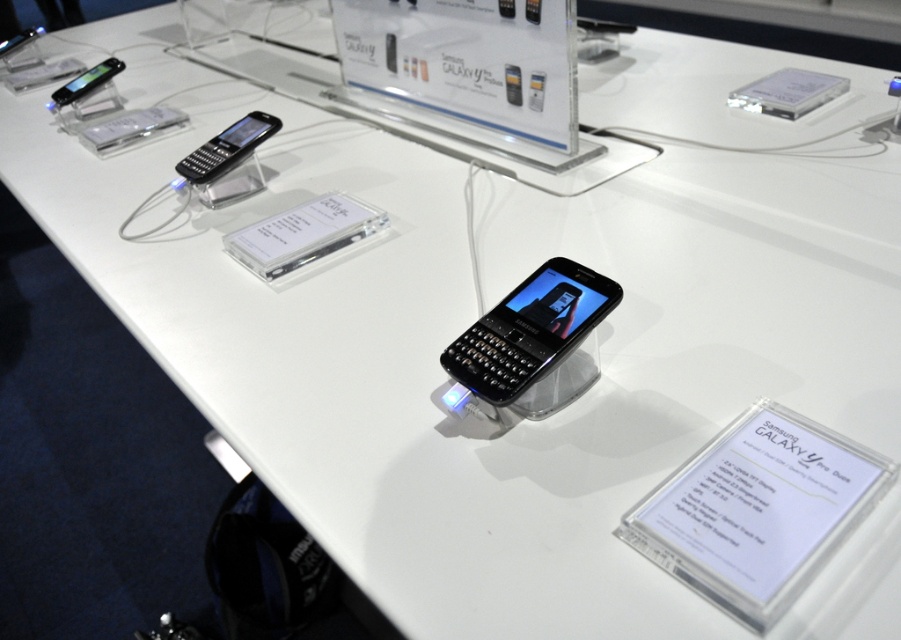
Question: Is black glossy phone at upper left bigger than matte black phone at upper left?

Choices:
 (A) yes
 (B) no

Answer: (B)

Question: Does black glossy phone at upper left appear on the left side of matte black phone at upper left?

Choices:
 (A) no
 (B) yes

Answer: (A)

Question: Which object is positioned farthest from the black matte keyboard phone at center?

Choices:
 (A) matte black phone at upper left
 (B) black glossy phone at upper left

Answer: (A)

Question: Estimate the real-world distances between objects in this image. Which object is farther from the black glossy phone at upper left?

Choices:
 (A) matte black phone at upper left
 (B) black matte keyboard phone at center

Answer: (B)

Question: Is black matte keyboard phone at center to the right of matte black phone at upper left from the viewer's perspective?

Choices:
 (A) yes
 (B) no

Answer: (A)

Question: Which object is positioned closest to the black matte keyboard phone at center?

Choices:
 (A) black glossy phone at upper left
 (B) matte black phone at upper left

Answer: (A)